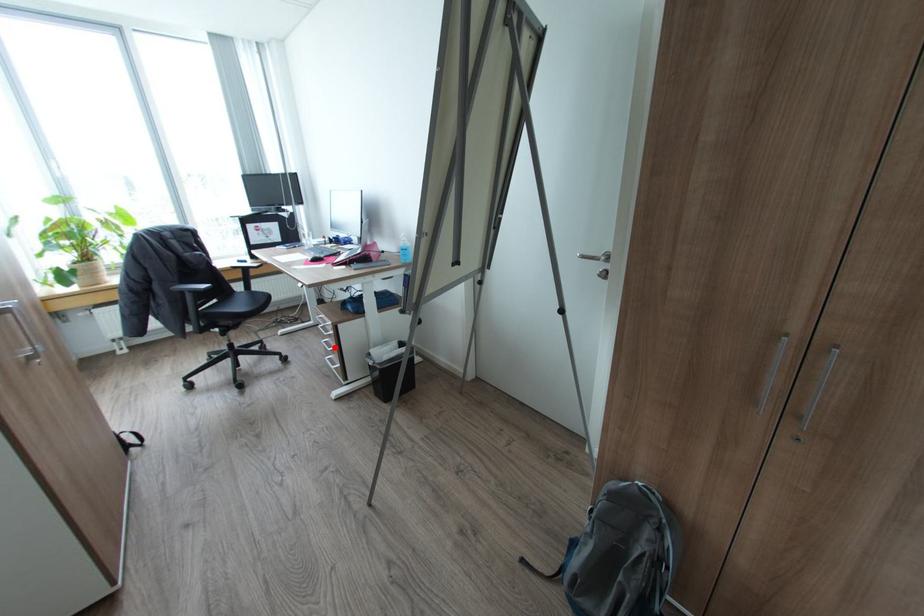
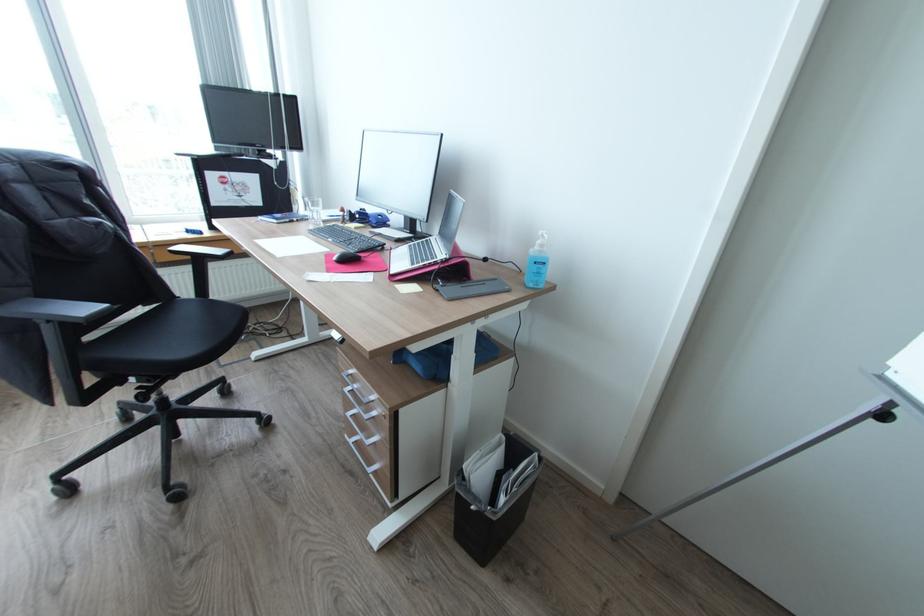
Where in the second image is the point corresponding to the highlighted location from the first image?

(372, 438)